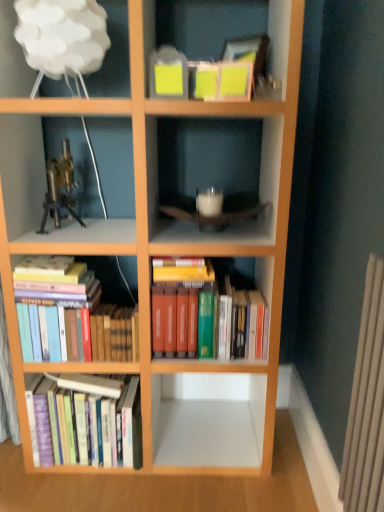
Question: From a real-world perspective, is hardcover books at center, marked as the 3th book in a left-to-right arrangement, over white cloud lampshade at upper left?

Choices:
 (A) no
 (B) yes

Answer: (A)

Question: Considering the relative positions of hardcover books at center, placed as the first book when sorted from right to left, and white cloud lampshade at upper left in the image provided, is hardcover books at center, placed as the first book when sorted from right to left, to the right of white cloud lampshade at upper left from the viewer's perspective?

Choices:
 (A) no
 (B) yes

Answer: (B)

Question: Does hardcover books at center, placed as the first book when sorted from right to left, have a larger size compared to white cloud lampshade at upper left?

Choices:
 (A) yes
 (B) no

Answer: (A)

Question: Is hardcover books at center, placed as the first book when sorted from right to left, smaller than white cloud lampshade at upper left?

Choices:
 (A) yes
 (B) no

Answer: (B)

Question: Does hardcover books at center, placed as the first book when sorted from right to left, turn towards white cloud lampshade at upper left?

Choices:
 (A) no
 (B) yes

Answer: (A)

Question: Is hardcover books at center, placed as the first book when sorted from right to left, further to the viewer compared to white cloud lampshade at upper left?

Choices:
 (A) yes
 (B) no

Answer: (A)

Question: Is hardcover books at lower left, which is counted as the second book, starting from the right, taller than hardcover books at center, placed as the first book when sorted from right to left?

Choices:
 (A) no
 (B) yes

Answer: (A)

Question: Considering the relative sizes of hardcover books at lower left, which is counted as the second book, starting from the right, and hardcover books at center, marked as the 3th book in a left-to-right arrangement, in the image provided, is hardcover books at lower left, which is counted as the second book, starting from the right, wider than hardcover books at center, marked as the 3th book in a left-to-right arrangement,?

Choices:
 (A) yes
 (B) no

Answer: (B)

Question: Are hardcover books at lower left, which is counted as the second book, starting from the right, and hardcover books at center, marked as the 3th book in a left-to-right arrangement, located far from each other?

Choices:
 (A) no
 (B) yes

Answer: (A)

Question: From the image's perspective, is hardcover books at lower left, which is counted as the second book, starting from the right, located beneath hardcover books at center, placed as the first book when sorted from right to left?

Choices:
 (A) no
 (B) yes

Answer: (B)

Question: Considering the relative sizes of hardcover books at lower left, which is counted as the second book, starting from the right, and hardcover books at center, placed as the first book when sorted from right to left, in the image provided, is hardcover books at lower left, which is counted as the second book, starting from the right, thinner than hardcover books at center, placed as the first book when sorted from right to left,?

Choices:
 (A) no
 (B) yes

Answer: (B)

Question: Does hardcover books at lower left, positioned as the 2th book in left-to-right order, have a larger size compared to hardcover books at center, marked as the 3th book in a left-to-right arrangement?

Choices:
 (A) no
 (B) yes

Answer: (A)

Question: Is gold metallic microscope at upper left positioned with its back to white cloud lampshade at upper left?

Choices:
 (A) yes
 (B) no

Answer: (B)